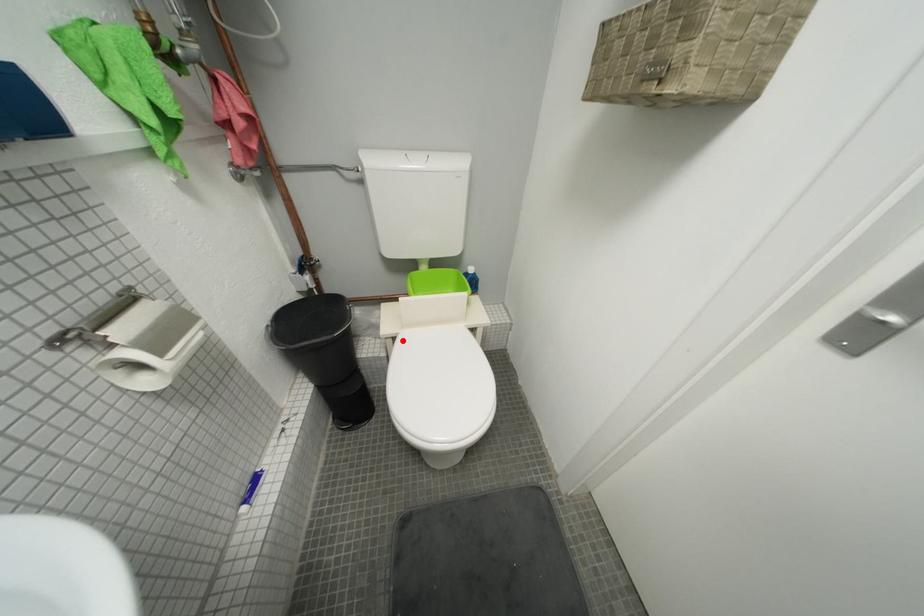
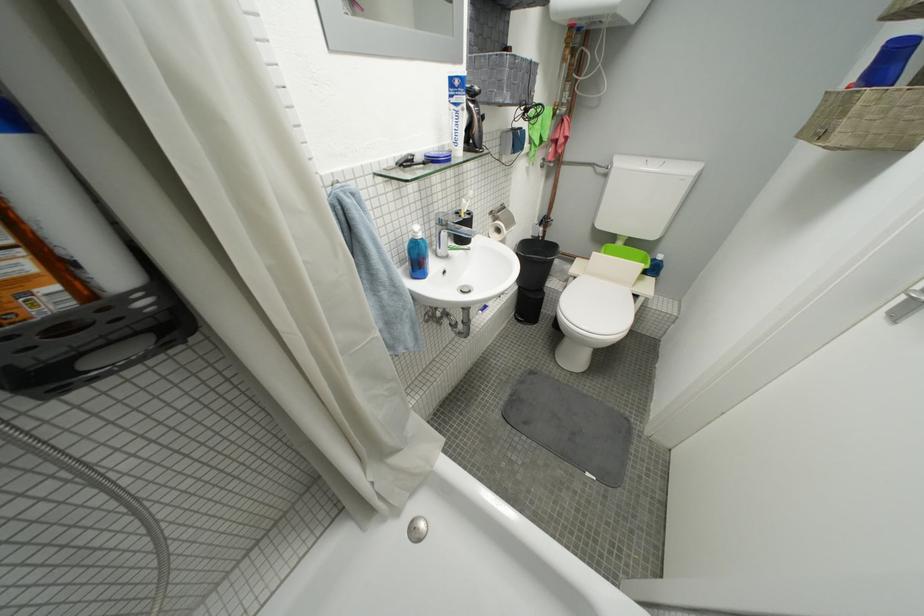
Question: I am providing you with two images of the same scene from different viewpoints. A red point is marked on the first image. Is the red point's position out of view in image 2?

Choices:
 (A) Yes
 (B) No

Answer: (B)